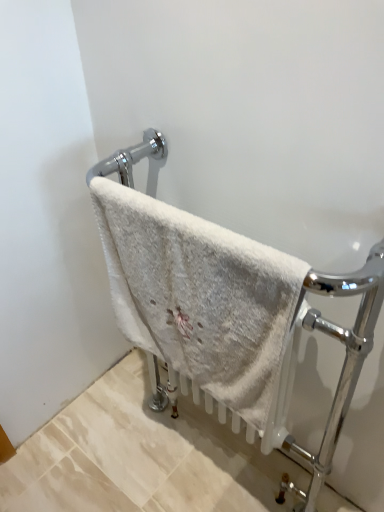
This screenshot has width=384, height=512. Describe the element at coordinates (198, 295) in the screenshot. I see `white fluffy towel at center` at that location.

Where is `white fluffy towel at center`? This screenshot has height=512, width=384. white fluffy towel at center is located at coordinates (198, 295).

In order to click on white fluffy towel at center in this screenshot , I will do `click(198, 295)`.